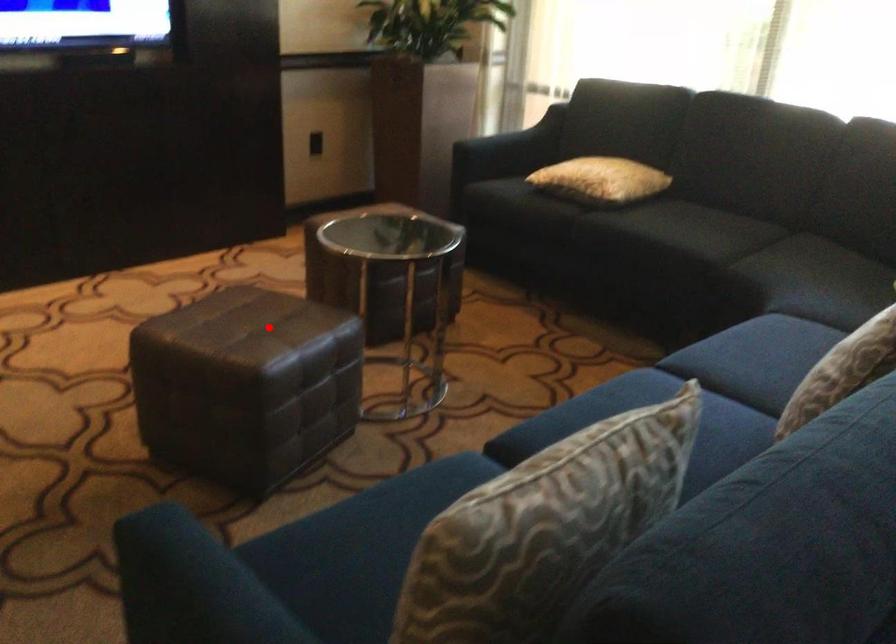
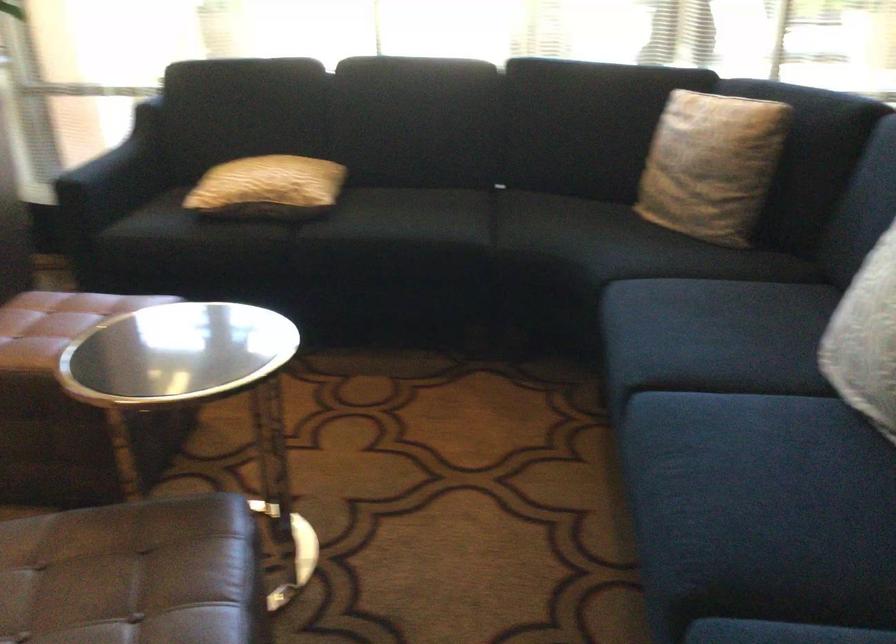
Question: A red point is marked in image1. In image2, is the corresponding 3D point closer to the camera or farther? Reply with the corresponding letter.

Choices:
 (A) The corresponding 3D point is closer.
 (B) The corresponding 3D point is farther.

Answer: (A)